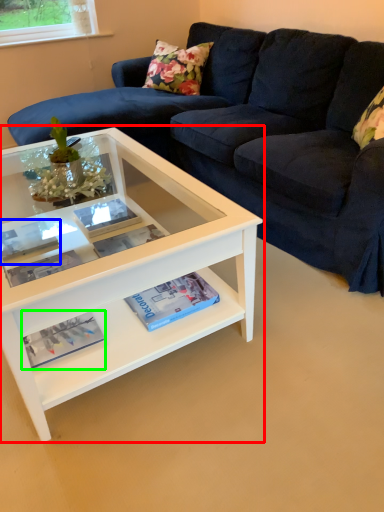
Question: Estimate the real-world distances between objects in this image. Which object is closer to coffee table (highlighted by a red box), book (highlighted by a blue box) or magazine (highlighted by a green box)?

Choices:
 (A) book
 (B) magazine

Answer: (A)